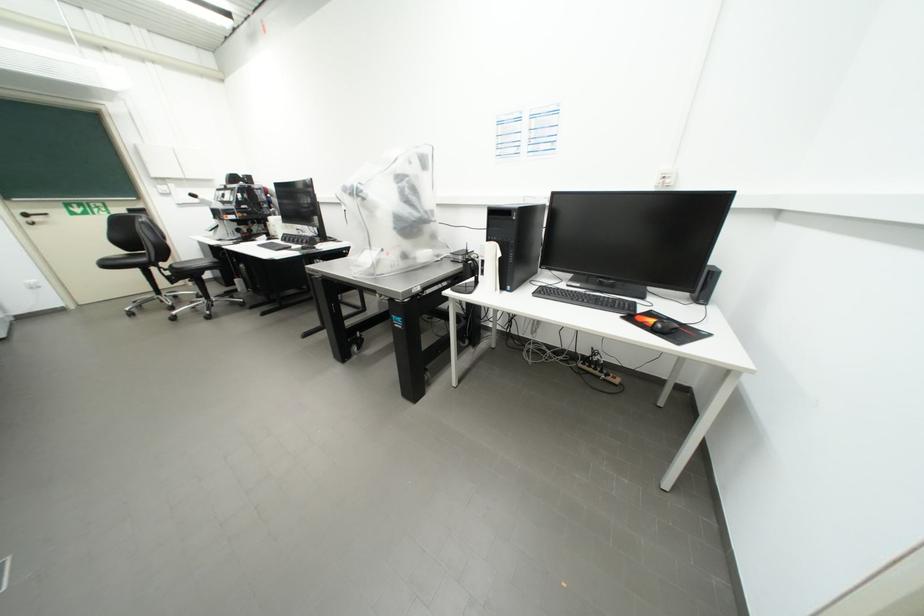
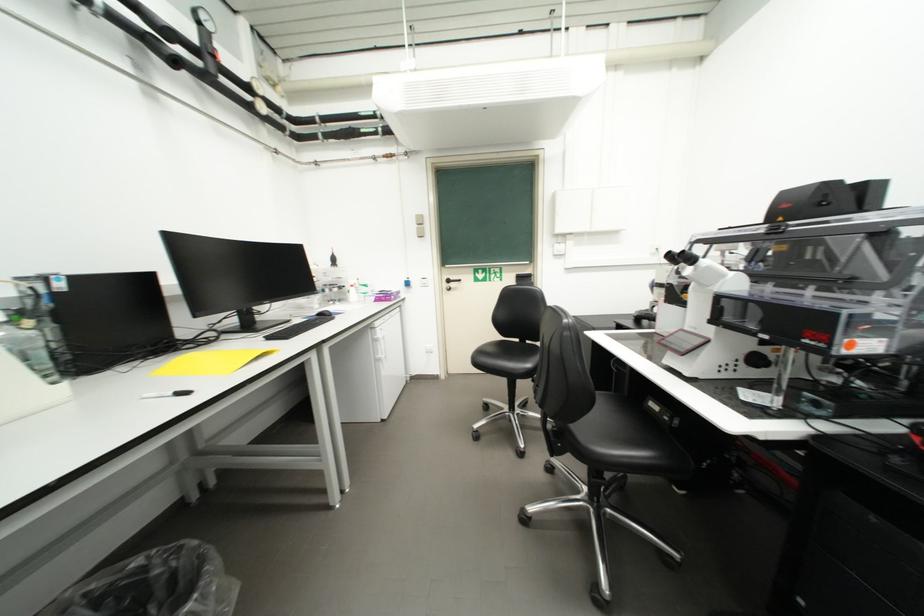
Where in the second image is the point corresponding to [34,217] from the first image?

(456, 283)